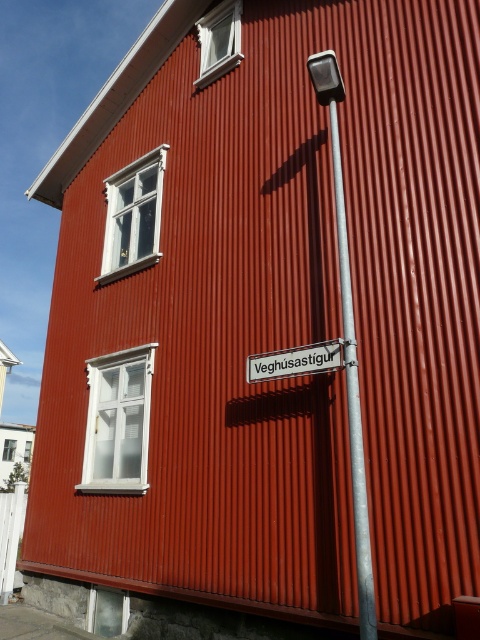
You are a delivery driver trying to park your van next to the metallic silver pole at center and the metallic silver street sign at center. Your van is 2 meters wide. Can you park your van between them without touching either?

The metallic silver pole at center is narrower than the metallic silver street sign at center. However, since the exact distance between them isn not provided, we cannot determine if the van can fit. More information is needed about the spacing between the pole and sign.

From the picture: You are standing in front of the vibrant red corrugated metal building and notice the metallic silver pole at center. Based on its coordinates, can you determine if the pole is closer to the lower window or the upper windows?

The metallic silver pole at center is located at point (352, 397). Since the lower window is positioned on the lower level and the upper windows are on the upper level, the pole is closer to the lower window because its y coordinate 0.735 is closer to 1.0 than to 0.0, assuming the coordinate system has the origin at the bottom left corner.

You are a delivery person trying to attach a new sign to the pole. The new sign is exactly the same size as the existing metallic silver street sign at center. Will the pole, which is the metallic silver pole at center, be able to hold the new sign without exceeding its height limit?

The metallic silver pole at center is taller than the metallic silver street sign at center, so yes, the pole can hold the new sign of the same size as the existing one without exceeding its height limit since the pole has enough vertical space.